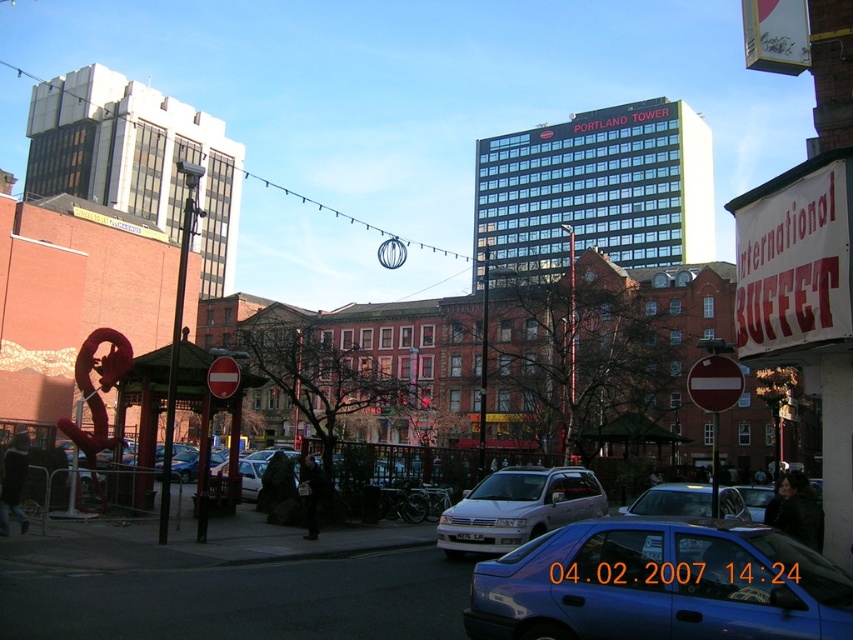
You are a pedestrian standing on the sidewalk and want to cross the street to reach the International Buffet. There are two cars in front of you. Which car, the blue metallic car at center or the metallic blue sedan at center, should you avoid walking behind because it is closer to you?

The blue metallic car at center is closer to the viewer than the metallic blue sedan at center, so you should avoid walking behind the blue metallic car at center as it is closer to you.

You are a delivery driver who needs to park your vehicle in this area. You have a compact car that is 1.8 meters wide. Looking at the blue metallic car at center and the metallic blue sedan at center, which one is narrower and can you fit your car between them?

The blue metallic car at center is thinner than the metallic blue sedan at center. Since your compact car is 1.8 meters wide, you need to check the width of the blue metallic car at center. However, the description only states that it is thinner than the sedan but does not provide exact measurements. Without specific width details, it is uncertain if your car will fit. Consider measuring the space or choosing another parking spot.

You are a delivery driver trying to park your truck between the blue metallic car at center and the metallic blue sedan at center. Your truck requires at least 2 meters of vertical clearance to pass under a low bridge ahead. Can you determine if there is enough space based on their heights?

The blue metallic car at center is not as tall as metallic blue sedan at center, but the exact height difference isn not provided. Without knowing the specific height of the taller vehicle, it is impossible to confirm if the 2 meters clearance is sufficient.